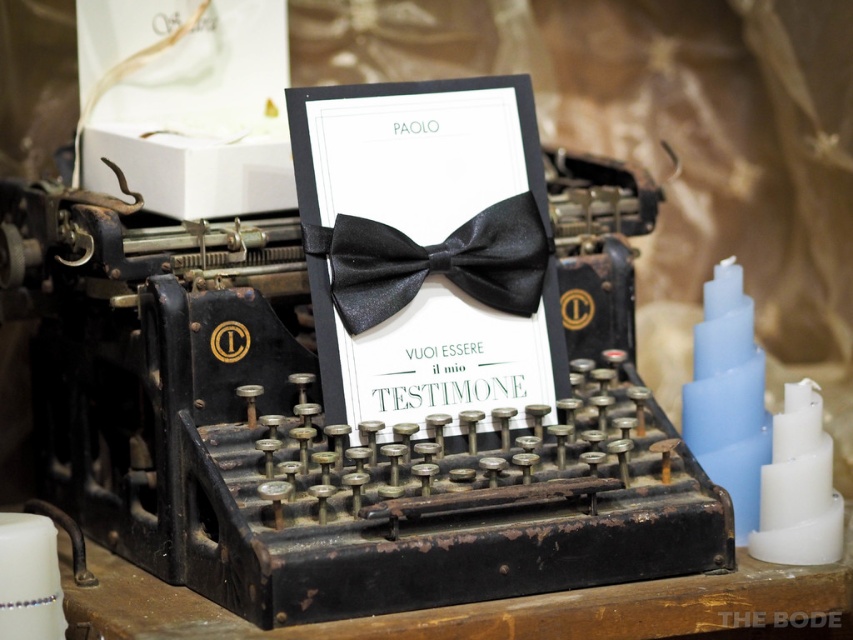
Who is shorter, black satin bow tie at center or white matte candle at lower left?

white matte candle at lower left is shorter.

How distant is black satin bow tie at center from white matte candle at lower left?

black satin bow tie at center and white matte candle at lower left are 17.66 inches apart from each other.

Where is `black satin bow tie at center`? This screenshot has height=640, width=853. black satin bow tie at center is located at coordinates (433, 260).

I want to click on black satin bow tie at center, so click(x=433, y=260).

Can you confirm if satin black bow tie at center is positioned below white matte candle at lower left?

Incorrect, satin black bow tie at center is not positioned below white matte candle at lower left.

Is satin black bow tie at center shorter than white matte candle at lower left?

No.

Which is in front, point (440, 417) or point (42, 564)?

Point (42, 564) is in front.

Where is `satin black bow tie at center`? This screenshot has width=853, height=640. satin black bow tie at center is located at coordinates (427, 250).

Is satin black bow tie at center further to the viewer compared to black satin bow tie at center?

No, satin black bow tie at center is closer to the viewer.

Is point (473, 332) behind point (373, 310)?

Yes, point (473, 332) is farther from viewer.

Between point (416, 355) and point (424, 253), which one is positioned in front?

Point (424, 253) is in front.

This screenshot has height=640, width=853. In order to click on satin black bow tie at center in this screenshot , I will do `click(427, 250)`.